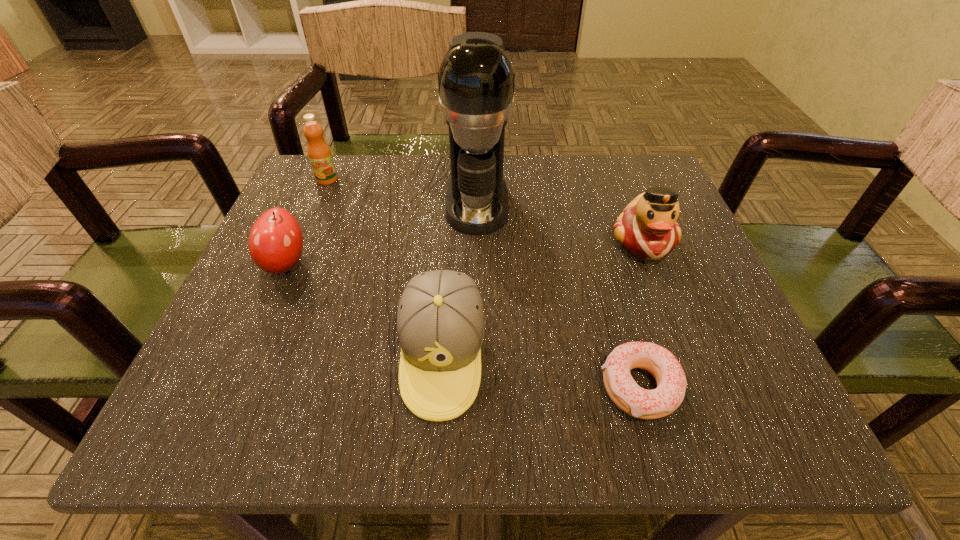
Where is `vacant region between the tallest object and the apple`? Image resolution: width=960 pixels, height=540 pixels. vacant region between the tallest object and the apple is located at coordinates (382, 233).

This screenshot has height=540, width=960. Identify the location of vacant area that lies between the duck and the coffee maker. (561, 222).

Identify the location of unoccupied area between the apple and the coffee maker. Image resolution: width=960 pixels, height=540 pixels. (382, 233).

Identify the location of free space between the shortest object and the coffee maker. This screenshot has height=540, width=960. (559, 295).

The image size is (960, 540). In order to click on free space that is in between the coffee maker and the apple in this screenshot , I will do `click(382, 233)`.

This screenshot has height=540, width=960. Find the location of `free spot between the apple and the tallest object`. free spot between the apple and the tallest object is located at coordinates (382, 233).

You are a GUI agent. You are given a task and a screenshot of the screen. Output one action in this format:
    pyautogui.click(x=<x>, y=<y>)
    Task: Click on the blank region between the shortest object and the duck
    
    Given the screenshot: What is the action you would take?
    pyautogui.click(x=641, y=315)

This screenshot has width=960, height=540. In order to click on free space that is in between the apple and the coffee maker in this screenshot , I will do point(382,233).

This screenshot has width=960, height=540. Find the location of `free area in between the doughnut and the duck`. free area in between the doughnut and the duck is located at coordinates point(641,315).

Find the location of a particular element. The height and width of the screenshot is (540, 960). object that is the closest to the baseball cap is located at coordinates (671, 381).